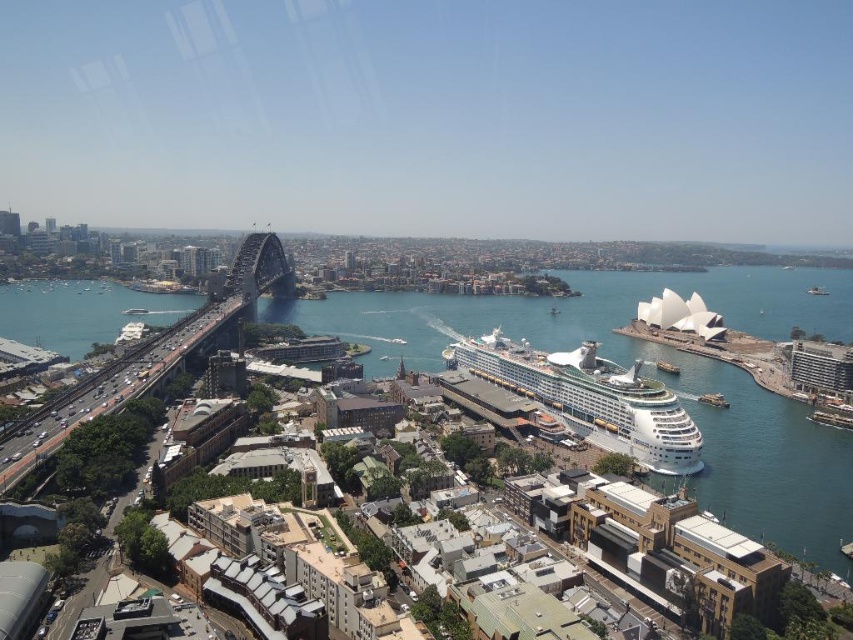
Question: Estimate the real-world distances between objects in this image. Which object is closer to the clear blue water at center?

Choices:
 (A) metallic gray bridge at left
 (B) white glossy cruise ship at center

Answer: (B)

Question: Which of the following is the farthest from the observer?

Choices:
 (A) white glossy cruise ship at center
 (B) clear blue water at center
 (C) metallic gray bridge at left

Answer: (A)

Question: Can you confirm if white glossy cruise ship at center is smaller than metallic gray bridge at left?

Choices:
 (A) yes
 (B) no

Answer: (A)

Question: Which is nearer to the clear blue water at center?

Choices:
 (A) metallic gray bridge at left
 (B) white glossy cruise ship at center

Answer: (B)

Question: Is clear blue water at center positioned at the back of metallic gray bridge at left?

Choices:
 (A) yes
 (B) no

Answer: (B)

Question: Does clear blue water at center have a larger size compared to white glossy cruise ship at center?

Choices:
 (A) no
 (B) yes

Answer: (B)